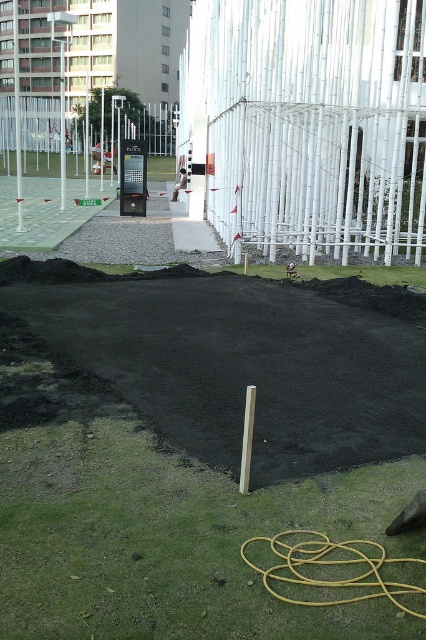
Can you confirm if white bamboo fence at upper center is positioned below white metal fence at upper center?

Indeed, white bamboo fence at upper center is positioned under white metal fence at upper center.

Is white bamboo fence at upper center thinner than white metal fence at upper center?

Yes.

Where is `white bamboo fence at upper center`? This screenshot has width=426, height=640. white bamboo fence at upper center is located at coordinates (307, 124).